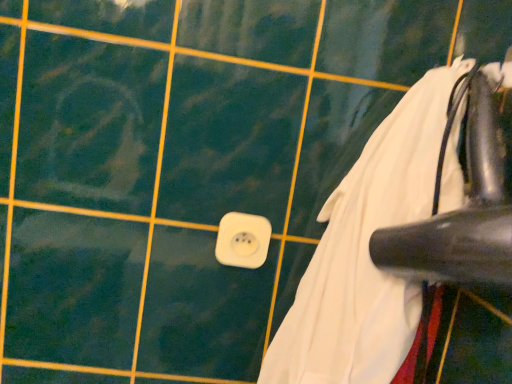
Identify the location of white plastic socket at center. The image size is (512, 384). (243, 240).

In order to face white plastic socket at center, should I rotate leftwards or rightwards?

Rotate left and turn 1.614 degrees.

What do you see at coordinates (243, 240) in the screenshot? Image resolution: width=512 pixels, height=384 pixels. I see `white plastic socket at center` at bounding box center [243, 240].

The width and height of the screenshot is (512, 384). Identify the location of white fabric at lower right. (366, 253).

What do you see at coordinates (366, 253) in the screenshot? The image size is (512, 384). I see `white fabric at lower right` at bounding box center [366, 253].

What is the approximate width of white fabric at lower right?

white fabric at lower right is 9.25 inches in width.

Image resolution: width=512 pixels, height=384 pixels. Identify the location of white plastic socket at center. (243, 240).

Considering the positions of objects white fabric at lower right and white plastic socket at center in the image provided, who is more to the right, white fabric at lower right or white plastic socket at center?

white fabric at lower right.

Relative to white plastic socket at center, is white fabric at lower right in front or behind?

white fabric at lower right is in front of white plastic socket at center.

Which point is more forward, [403,138] or [268,221]?

Positioned in front is point [403,138].

From the image's perspective, which one is positioned higher, white fabric at lower right or white plastic socket at center?

From the image's view, white fabric at lower right is above.

From a real-world perspective, is white fabric at lower right physically located above or below white plastic socket at center?

white fabric at lower right is situated higher than white plastic socket at center in the real world.

Which of these two, white fabric at lower right or white plastic socket at center, is wider?

white fabric at lower right is wider.

Does white fabric at lower right have a lesser height compared to white plastic socket at center?

No, white fabric at lower right is not shorter than white plastic socket at center.

Can you confirm if white fabric at lower right is bigger than white plastic socket at center?

Indeed, white fabric at lower right has a larger size compared to white plastic socket at center.

Is white fabric at lower right spatially inside white plastic socket at center, or outside of it?

white fabric at lower right is not inside white plastic socket at center, it's outside.

Are white fabric at lower right and white plastic socket at center far apart?

No, white fabric at lower right is not far away from white plastic socket at center.

Is white fabric at lower right looking in the opposite direction of white plastic socket at center?

white fabric at lower right is not turned away from white plastic socket at center.

How different are the orientations of white fabric at lower right and white plastic socket at center in degrees?

They differ by 88.9 degrees in their facing directions.

How much distance is there between white fabric at lower right and white plastic socket at center?

white fabric at lower right and white plastic socket at center are 7.21 inches apart.

Locate an element on the screen. power plugs and sockets below the white fabric at lower right (from a real-world perspective) is located at coordinates (243, 240).

Between white plastic socket at center and white fabric at lower right, which one appears on the right side from the viewer's perspective?

white fabric at lower right is more to the right.

Which is behind, white plastic socket at center or white fabric at lower right?

white plastic socket at center is behind.

Considering the positions of point (228, 219) and point (372, 375), is point (228, 219) closer or farther from the camera than point (372, 375)?

Point (228, 219) is positioned farther from the camera compared to point (372, 375).

From the image's perspective, who appears lower, white plastic socket at center or white fabric at lower right?

white plastic socket at center, from the image's perspective.

From a real-world perspective, is white plastic socket at center beneath white fabric at lower right?

Yes, from a real-world perspective, white plastic socket at center is under white fabric at lower right.

Can you confirm if white plastic socket at center is wider than white fabric at lower right?

No.

Is white plastic socket at center taller or shorter than white fabric at lower right?

In the image, white plastic socket at center appears to be shorter than white fabric at lower right.

Does white plastic socket at center have a larger size compared to white fabric at lower right?

No, white plastic socket at center is not bigger than white fabric at lower right.

Looking at this image, do you think white plastic socket at center is within white fabric at lower right, or outside of it?

white plastic socket at center is not enclosed by white fabric at lower right.

Is white plastic socket at center positioned far away from white fabric at lower right?

Actually, white plastic socket at center and white fabric at lower right are a little close together.

Is white plastic socket at center oriented away from white fabric at lower right?

white plastic socket at center is not turned away from white fabric at lower right.

Can you tell me how much white plastic socket at center and white fabric at lower right differ in facing direction?

They differ by 88.9 degrees in their facing directions.

Measure the distance from white plastic socket at center to white fabric at lower right.

A distance of 7.21 inches exists between white plastic socket at center and white fabric at lower right.

Locate an element on the screen. The image size is (512, 384). power plugs and sockets behind the white fabric at lower right is located at coordinates (243, 240).

Find the location of a particular element. The height and width of the screenshot is (384, 512). laundry that is above the white plastic socket at center (from a real-world perspective) is located at coordinates (366, 253).

Where is `power plugs and sockets below the white fabric at lower right (from a real-world perspective)`? power plugs and sockets below the white fabric at lower right (from a real-world perspective) is located at coordinates (243, 240).